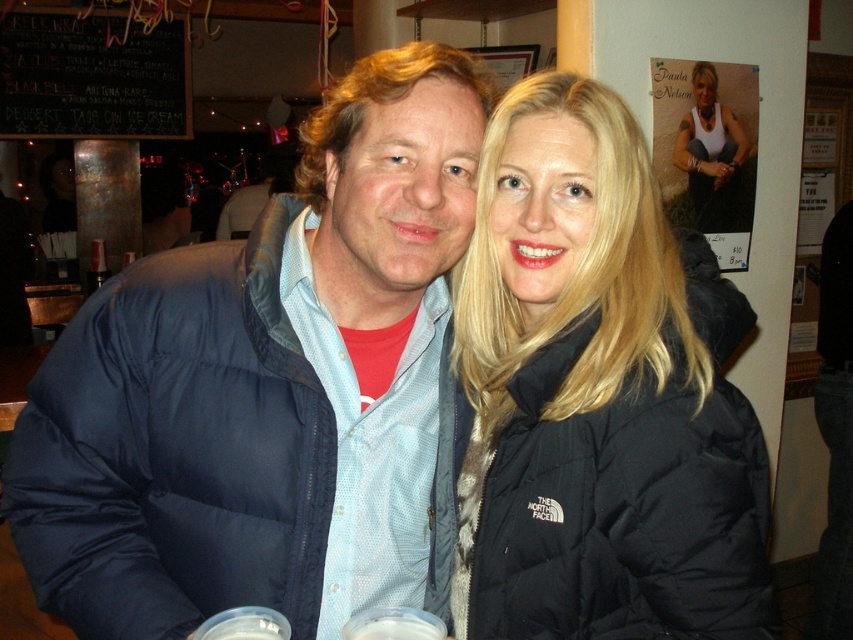
Is black down jacket at center thinner than white tank top at upper right?

No.

Is black down jacket at center closer to camera compared to white tank top at upper right?

Yes, it is.

The image size is (853, 640). What do you see at coordinates (598, 394) in the screenshot? I see `black down jacket at center` at bounding box center [598, 394].

Locate an element on the screen. The height and width of the screenshot is (640, 853). black down jacket at center is located at coordinates (598, 394).

Who is lower down, blue down jacket at center or black down jacket at center?

Positioned lower is blue down jacket at center.

Measure the distance between blue down jacket at center and black down jacket at center.

They are 8.24 inches apart.

Describe the element at coordinates (267, 387) in the screenshot. I see `blue down jacket at center` at that location.

Where is `blue down jacket at center`? blue down jacket at center is located at coordinates (267, 387).

Between blue down jacket at center and white tank top at upper right, which one has less height?

white tank top at upper right is shorter.

Which is behind, point (148, 358) or point (714, 157)?

Point (714, 157)

This screenshot has height=640, width=853. Find the location of `blue down jacket at center`. blue down jacket at center is located at coordinates (267, 387).